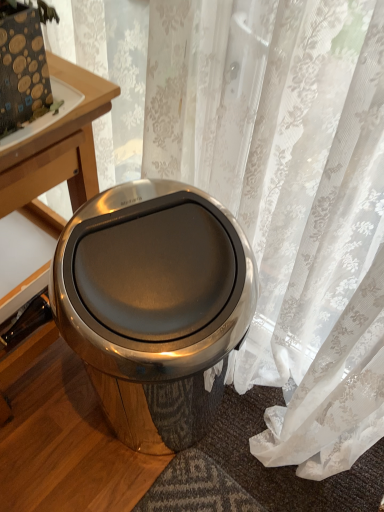
Question: Is wooden table at upper left inside the boundaries of translucent floral curtain at center, or outside?

Choices:
 (A) inside
 (B) outside

Answer: (B)

Question: From the image's perspective, is wooden table at upper left positioned above or below translucent floral curtain at center?

Choices:
 (A) below
 (B) above

Answer: (B)

Question: Which is nearer to the wooden table at left?

Choices:
 (A) wooden table at upper left
 (B) translucent floral curtain at center
 (C) polished stainless steel trash can at center

Answer: (A)

Question: Estimate the real-world distances between objects in this image. Which object is closer to the wooden table at left?

Choices:
 (A) translucent floral curtain at center
 (B) polished stainless steel trash can at center
 (C) wooden table at upper left

Answer: (C)